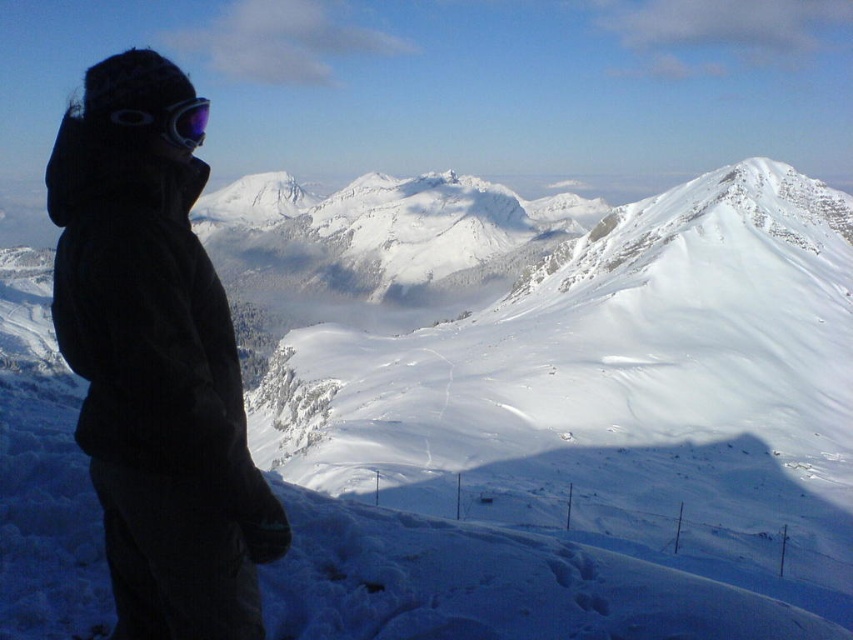
Question: Is black fleece jacket at left wider than matte purple goggles at upper left?

Choices:
 (A) yes
 (B) no

Answer: (A)

Question: Is black fleece jacket at left wider than matte purple goggles at upper left?

Choices:
 (A) no
 (B) yes

Answer: (B)

Question: Which point is farther to the camera?

Choices:
 (A) (222, 401)
 (B) (163, 113)

Answer: (A)

Question: Does black fleece jacket at left appear on the left side of matte purple goggles at upper left?

Choices:
 (A) yes
 (B) no

Answer: (A)